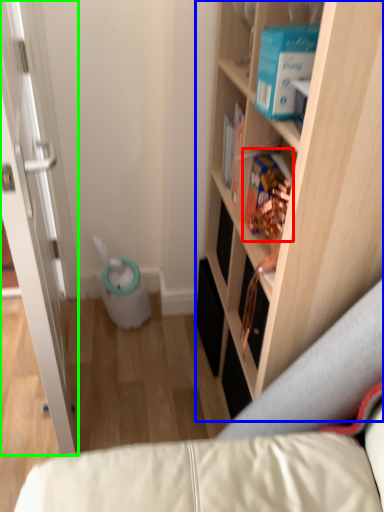
Question: Estimate the real-world distances between objects in this image. Which object is closer to book (highlighted by a red box), cabinetry (highlighted by a blue box) or door (highlighted by a green box)?

Choices:
 (A) cabinetry
 (B) door

Answer: (A)